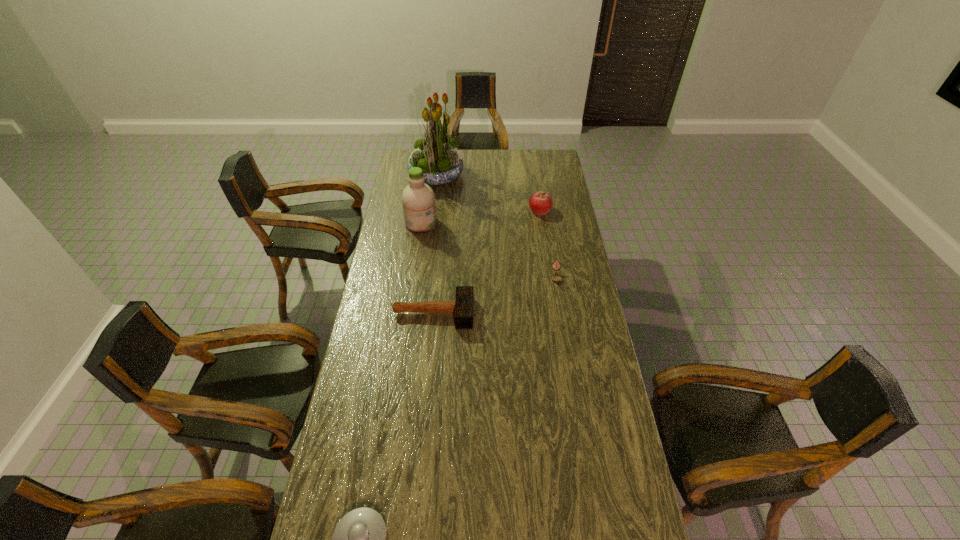
Find the location of a particular element. This screenshot has width=960, height=540. free space located on the left of the third tallest object is located at coordinates (461, 210).

I want to click on vacant space situated 0.180m on the hammer head face of the third shortest object, so click(518, 313).

Locate an element on the screen. vacant area located 0.310m on the face of the fifth tallest object is located at coordinates (568, 349).

Locate an element on the screen. The height and width of the screenshot is (540, 960). object positioned at the far edge is located at coordinates (437, 155).

The image size is (960, 540). I want to click on flower arrangement present at the left edge, so click(x=437, y=155).

This screenshot has width=960, height=540. In order to click on cleansing agent at the left edge in this screenshot , I will do `click(418, 199)`.

Image resolution: width=960 pixels, height=540 pixels. Find the location of `mallet positioned at the left edge`. mallet positioned at the left edge is located at coordinates (463, 305).

Locate an element on the screen. The image size is (960, 540). apple located in the right edge section of the desktop is located at coordinates (540, 203).

The image size is (960, 540). Find the location of `compass that is at the right edge`. compass that is at the right edge is located at coordinates (556, 278).

Image resolution: width=960 pixels, height=540 pixels. I want to click on object present at the far left corner, so coord(437,155).